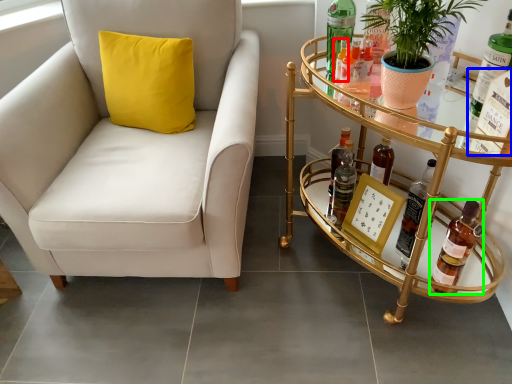
Question: Which object is positioned farthest from bottle (highlighted by a red box)? Select from bottle (highlighted by a blue box) and bottle (highlighted by a green box).

Choices:
 (A) bottle
 (B) bottle

Answer: (B)